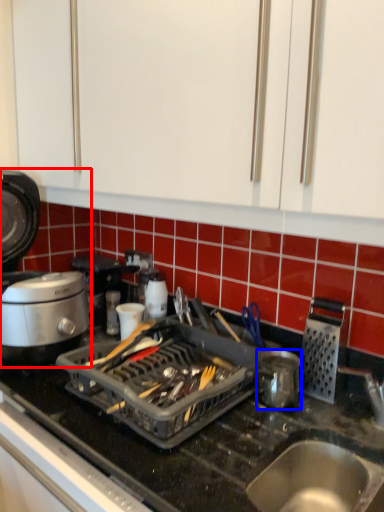
Question: Which object is closer to the camera taking this photo, kitchen appliance (highlighted by a red box) or kitchen appliance (highlighted by a blue box)?

Choices:
 (A) kitchen appliance
 (B) kitchen appliance

Answer: (A)